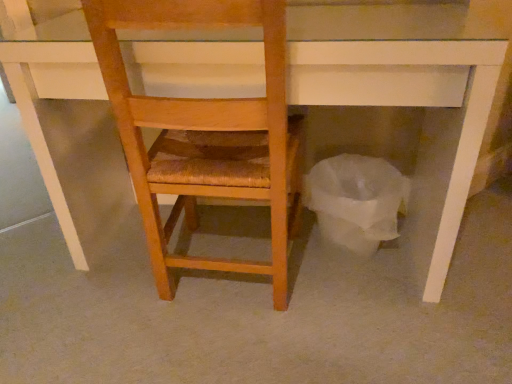
Find the location of `free region under white paper bag at lower right (from a real-world perspective)`. free region under white paper bag at lower right (from a real-world perspective) is located at coordinates (349, 260).